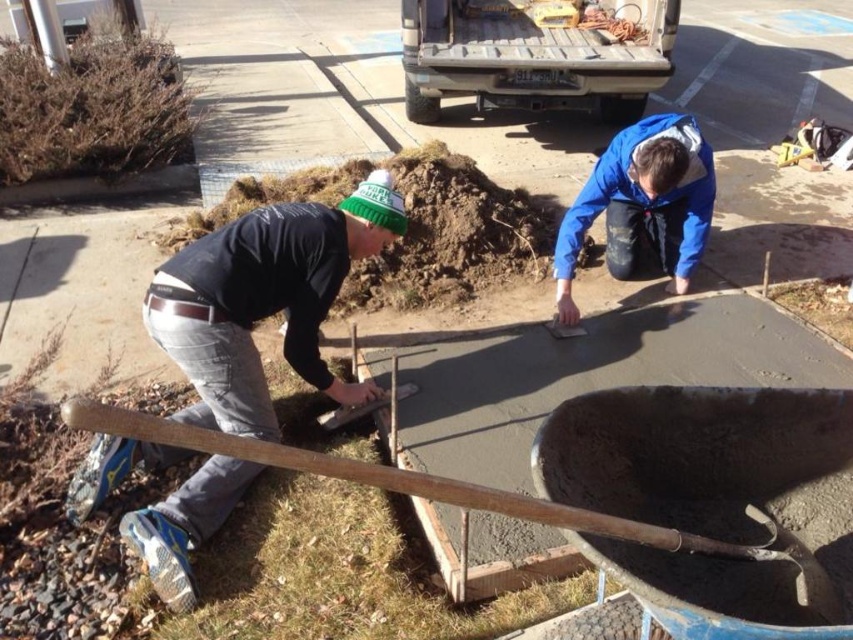
You are a contractor assessing the workspace. You see the blue matte jacket at center and the wooden shovel at lower left. Which object occupies more space in the scene?

The blue matte jacket at center has a larger size compared to the wooden shovel at lower left, so it occupies more space in the scene.

In the scene shown: You are a contractor assessing the scene. You notice two items in the image. One is dark gray jeans at lower left and the other is blue matte jacket at center. Which item is bigger in size?

The dark gray jeans at lower left has a larger size compared to blue matte jacket at center, so the dark gray jeans at lower left is bigger.